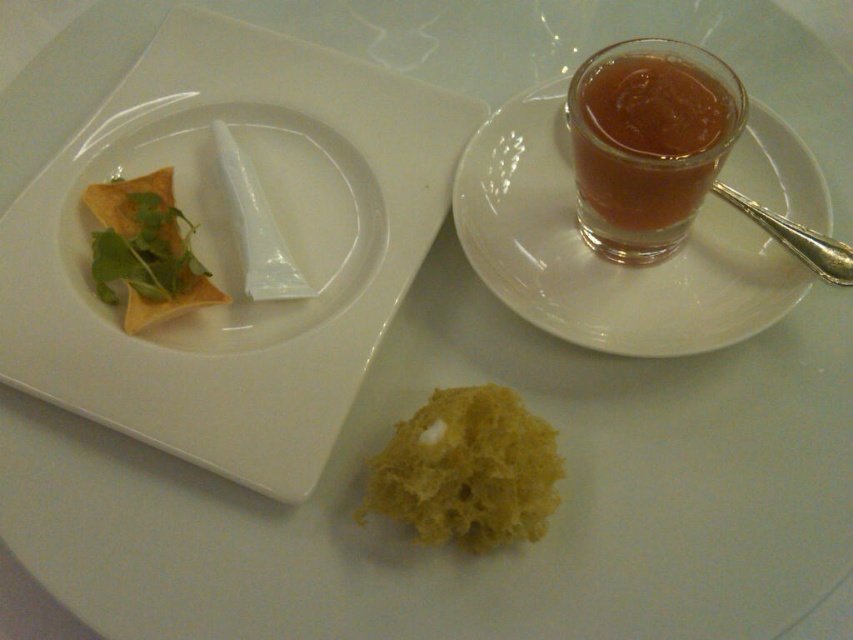
Based on the photo, can you confirm if transparent glass saucer at upper right is positioned to the left of yellow sponge at center?

Incorrect, transparent glass saucer at upper right is not on the left side of yellow sponge at center.

Does point (788, 154) come farther from viewer compared to point (421, 435)?

Yes, it is.

I want to click on transparent glass saucer at upper right, so click(602, 259).

Does transparent glass saucer at upper right lie in front of translucent amber liquid at upper right?

No, transparent glass saucer at upper right is further to the viewer.

Between transparent glass saucer at upper right and translucent amber liquid at upper right, which one has less height?

With less height is translucent amber liquid at upper right.

Between point (527, 150) and point (608, 196), which one is positioned in front?

Point (608, 196) is in front.

Identify the location of transparent glass saucer at upper right. (602, 259).

Is yellow sponge at center closer to camera compared to matte yellow tortilla at upper left?

Yes.

Is point (364, 508) closer to camera compared to point (119, 209)?

Yes, point (364, 508) is closer to viewer.

Is point (480, 540) positioned after point (126, 320)?

No, (480, 540) is closer to viewer.

At what (x,y) coordinates should I click in order to perform the action: click on yellow sponge at center. Please return your answer as a coordinate pair (x, y). Looking at the image, I should click on (467, 470).